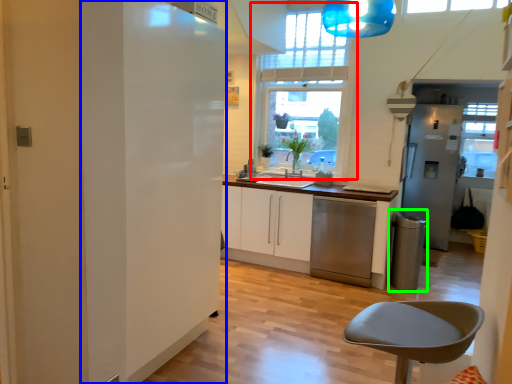
Question: Considering the real-world distances, which object is farthest from window (highlighted by a red box)? fridge (highlighted by a blue box) or appliance (highlighted by a green box)?

Choices:
 (A) fridge
 (B) appliance

Answer: (A)